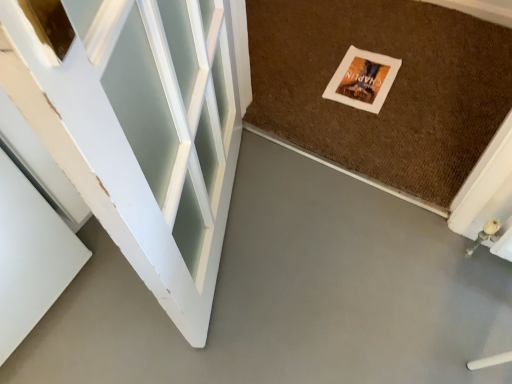
Identify the location of free space to the right of matte paper postcard at center. This screenshot has height=384, width=512. (428, 74).